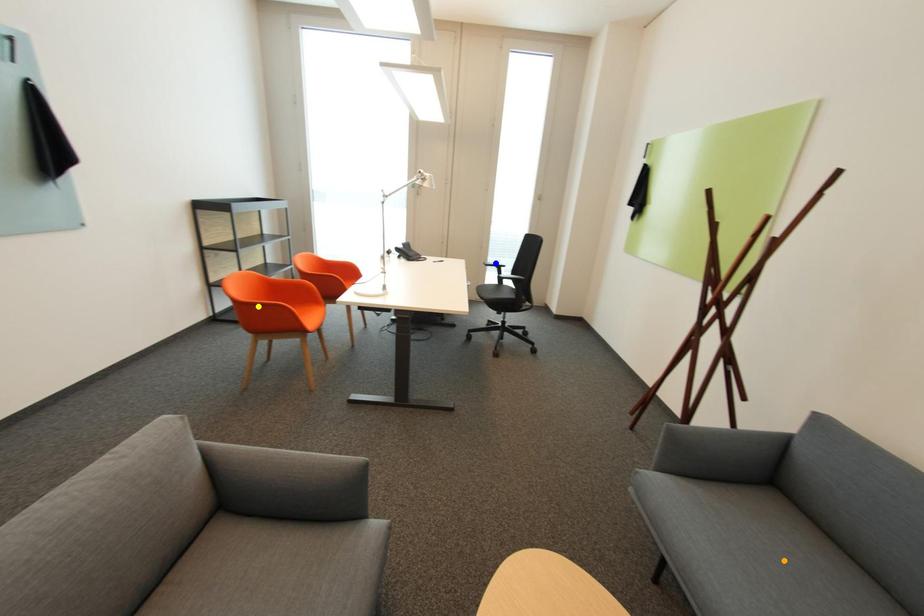
From the picture: Order these from nearest to farthest:
A) yellow point
B) orange point
C) blue point

1. orange point
2. yellow point
3. blue point